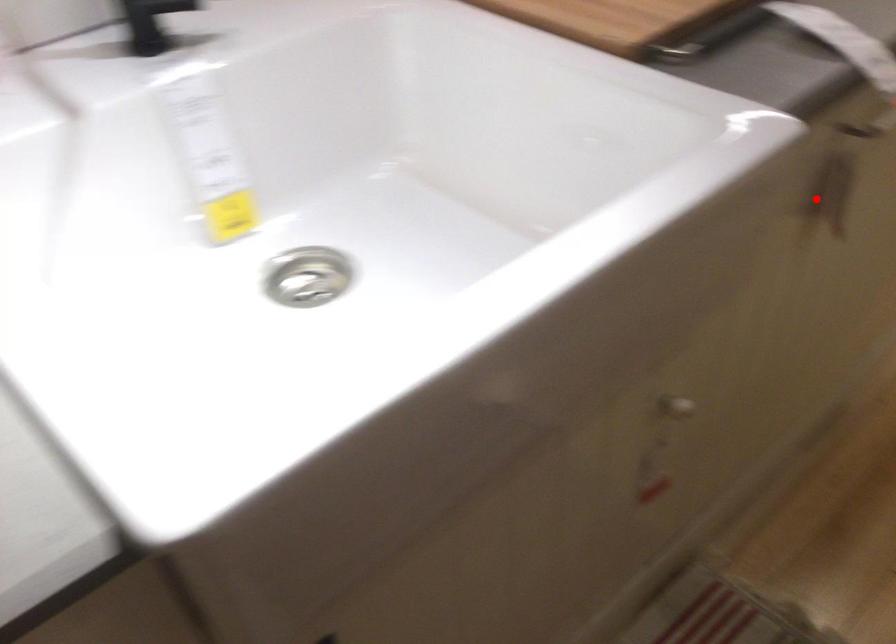
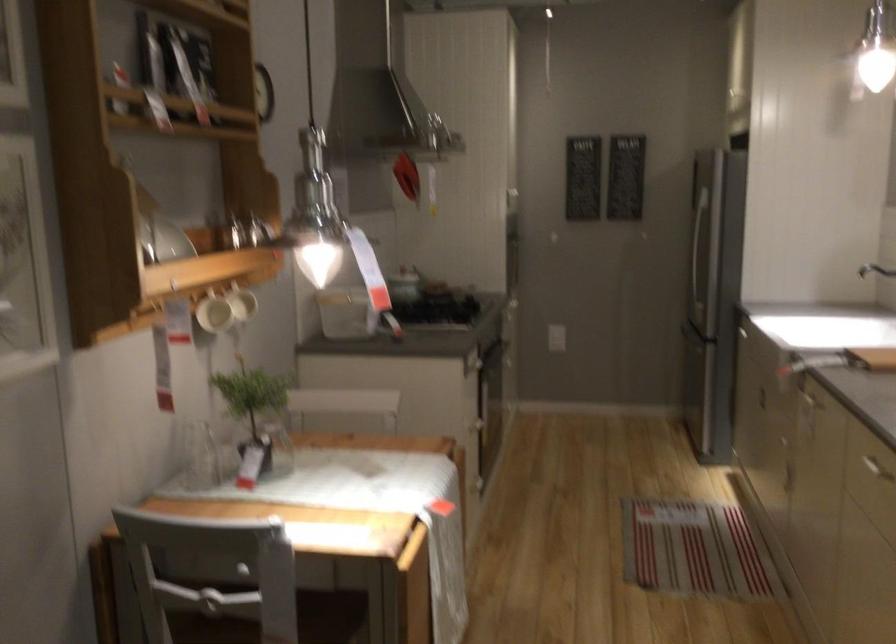
Question: I am providing you with two images of the same scene from different viewpoints. Image1 has a red point marked. In image2, the corresponding 3D location appears at what relative position? Reply with the corresponding letter.

Choices:
 (A) Closer
 (B) Farther

Answer: (B)